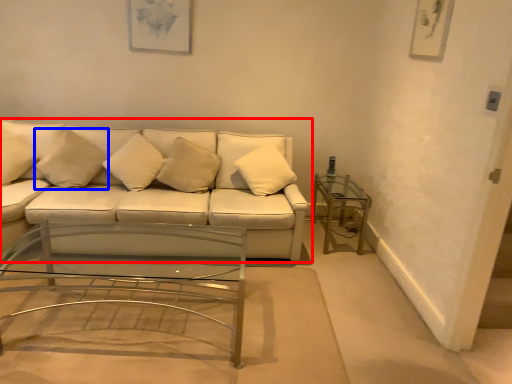
Question: Which object appears farthest to the camera in this image, studio couch (highlighted by a red box) or pillow (highlighted by a blue box)?

Choices:
 (A) studio couch
 (B) pillow

Answer: (B)